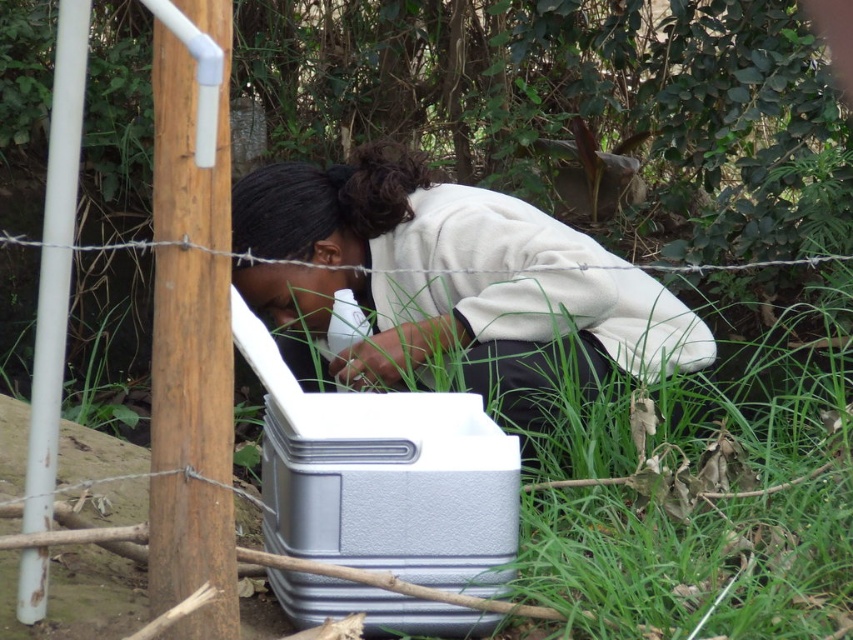
Question: Which point is farther to the camera?

Choices:
 (A) silver textured cooler at center
 (B) brown wood pole at left

Answer: (A)

Question: Estimate the real-world distances between objects in this image. Which object is closer to the white matte cooler at center?

Choices:
 (A) brown wood pole at left
 (B) silver textured cooler at center
 (C) white matte pole at left

Answer: (B)

Question: Is white matte cooler at center in front of silver textured cooler at center?

Choices:
 (A) yes
 (B) no

Answer: (B)

Question: Which point appears closest to the camera in this image?

Choices:
 (A) (223, 280)
 (B) (447, 241)
 (C) (35, 460)

Answer: (A)

Question: Is white matte cooler at center positioned before brown wood pole at left?

Choices:
 (A) no
 (B) yes

Answer: (A)

Question: Can you confirm if white matte cooler at center is positioned to the left of silver textured cooler at center?

Choices:
 (A) no
 (B) yes

Answer: (A)